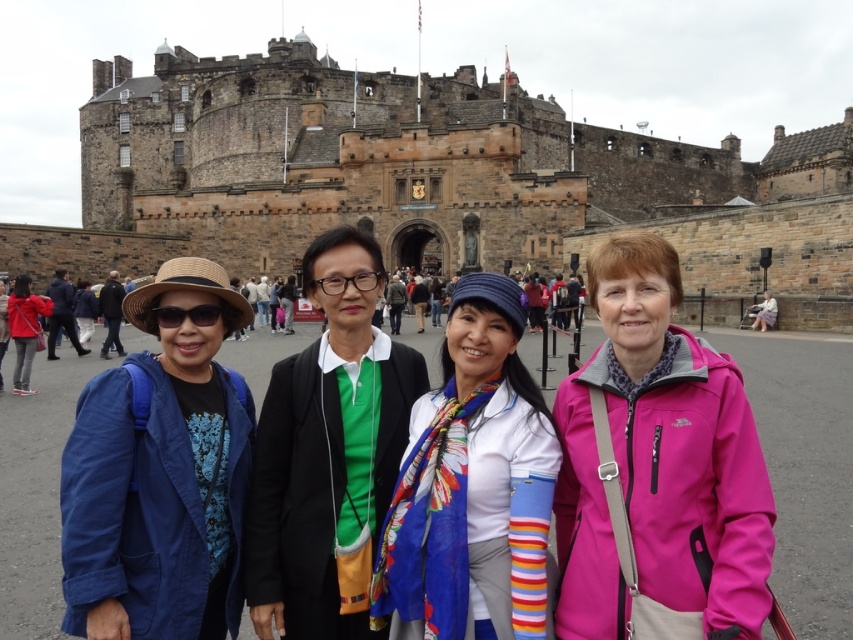
Is matte blue jacket at lower left bigger than green matte shirt at center?

No.

Consider the image. Who is positioned more to the right, matte blue jacket at lower left or green matte shirt at center?

From the viewer's perspective, green matte shirt at center appears more on the right side.

The width and height of the screenshot is (853, 640). I want to click on matte blue jacket at lower left, so (x=160, y=474).

Identify the location of matte blue jacket at lower left. (160, 474).

Between pink softshell jacket at right and white matte scarf at center, which one has less height?

white matte scarf at center

Is pink softshell jacket at right closer to the viewer compared to white matte scarf at center?

Yes, pink softshell jacket at right is closer to the viewer.

This screenshot has height=640, width=853. Describe the element at coordinates (657, 468) in the screenshot. I see `pink softshell jacket at right` at that location.

The height and width of the screenshot is (640, 853). In order to click on pink softshell jacket at right in this screenshot , I will do `click(657, 468)`.

Does brown stone castle at center have a lesser height compared to green matte shirt at center?

Incorrect, brown stone castle at center's height does not fall short of green matte shirt at center's.

Is brown stone castle at center closer to camera compared to green matte shirt at center?

No, it is not.

Is point (326, 221) farther from viewer compared to point (358, 435)?

Yes, it is behind point (358, 435).

Where is `brown stone castle at center`? This screenshot has width=853, height=640. brown stone castle at center is located at coordinates [419, 177].